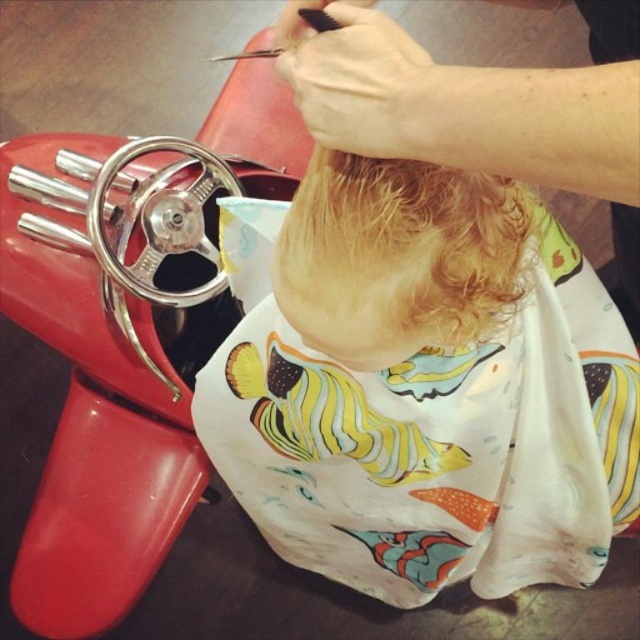
Question: Is blonde hair at center thinner than curly blonde hair at center?

Choices:
 (A) no
 (B) yes

Answer: (A)

Question: Does curly blonde hair at center have a smaller size compared to black plastic comb at upper center?

Choices:
 (A) no
 (B) yes

Answer: (A)

Question: Does blonde hair at center have a larger size compared to curly blonde hair at center?

Choices:
 (A) no
 (B) yes

Answer: (B)

Question: Estimate the real-world distances between objects in this image. Which object is closer to the blonde hair at center?

Choices:
 (A) curly blonde hair at center
 (B) black plastic comb at upper center

Answer: (A)

Question: Which point is farther to the camera?

Choices:
 (A) curly blonde hair at center
 (B) blonde hair at center

Answer: (A)

Question: Which point is farther from the camera taking this photo?

Choices:
 (A) pos(403,196)
 (B) pos(592,364)

Answer: (B)